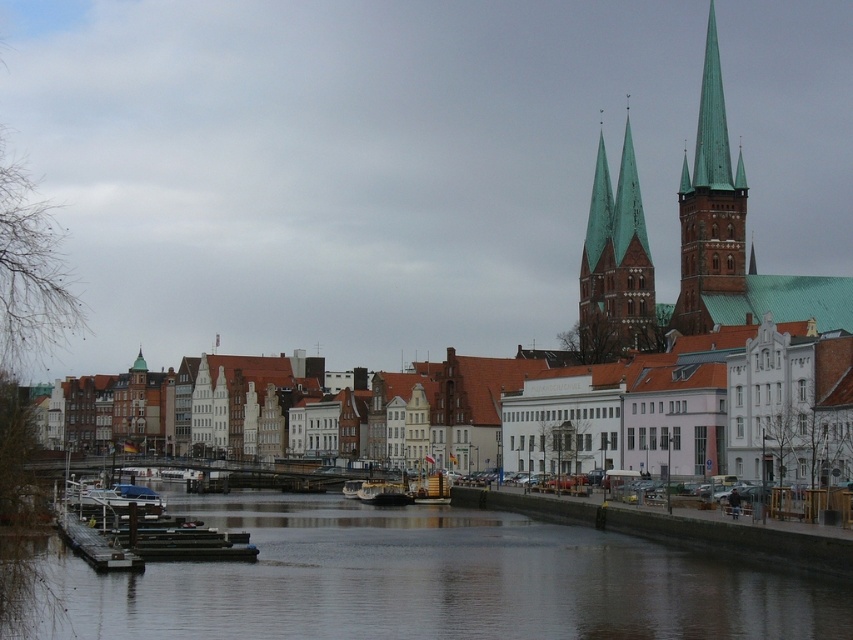
Does green copper spire at upper right have a smaller size compared to wooden boat at center?

Actually, green copper spire at upper right might be larger than wooden boat at center.

In the scene shown: Who is shorter, green copper spire at upper right or wooden boat at center?

wooden boat at center

This screenshot has width=853, height=640. In order to click on green copper spire at upper right in this screenshot , I will do `click(709, 204)`.

At what (x,y) coordinates should I click in order to perform the action: click on green copper spire at upper right. Please return your answer as a coordinate pair (x, y). This screenshot has width=853, height=640. Looking at the image, I should click on (709, 204).

Can you confirm if metallic gray barge at center is taller than metallic silver boat at center?

Indeed, metallic gray barge at center has a greater height compared to metallic silver boat at center.

Between metallic gray barge at center and metallic silver boat at center, which one has less height?

Standing shorter between the two is metallic silver boat at center.

Which is in front, point (369, 497) or point (354, 493)?

Positioned in front is point (369, 497).

Locate an element on the screen. The image size is (853, 640). metallic gray barge at center is located at coordinates (381, 492).

Locate an element on the screen. The image size is (853, 640). white smooth buildings at center is located at coordinates click(697, 410).

Which is above, white smooth buildings at center or green copper spires at upper center?

Positioned higher is green copper spires at upper center.

Between point (689, 381) and point (622, 353), which one is positioned in front?

Point (689, 381)

Find the location of a particular element. The height and width of the screenshot is (640, 853). white smooth buildings at center is located at coordinates (697, 410).